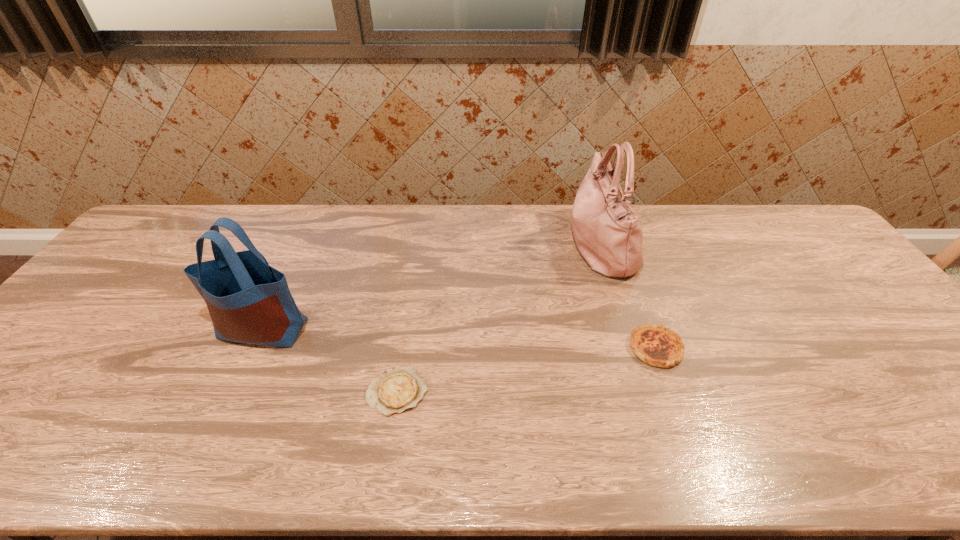
Point out which object is positioned as the second nearest to the shorter quiche. Please provide its 2D coordinates. Your answer should be formatted as a tuple, i.e. [(x, y)], where the tuple contains the x and y coordinates of a point satisfying the conditions above.

[(608, 235)]

Identify the location of free space in the image that satisfies the following two spatial constraints: 1. on the front side of the left handbag; 2. on the left side of the shorter quiche. (233, 392).

What are the coordinates of `vacant region that satisfies the following two spatial constraints: 1. at the front of the farthest object with handles; 2. on the front side of the shorter quiche` in the screenshot? It's located at (647, 392).

At what (x,y) coordinates should I click in order to perform the action: click on free space that satisfies the following two spatial constraints: 1. on the front side of the second shortest object; 2. on the right side of the leftmost object. Please return your answer as a coordinate pair (x, y). The image size is (960, 540). Looking at the image, I should click on (253, 348).

At what (x,y) coordinates should I click in order to perform the action: click on vacant area that satisfies the following two spatial constraints: 1. at the front of the farthest object with handles; 2. on the back side of the right quiche. Please return your answer as a coordinate pair (x, y). Image resolution: width=960 pixels, height=540 pixels. Looking at the image, I should click on (634, 348).